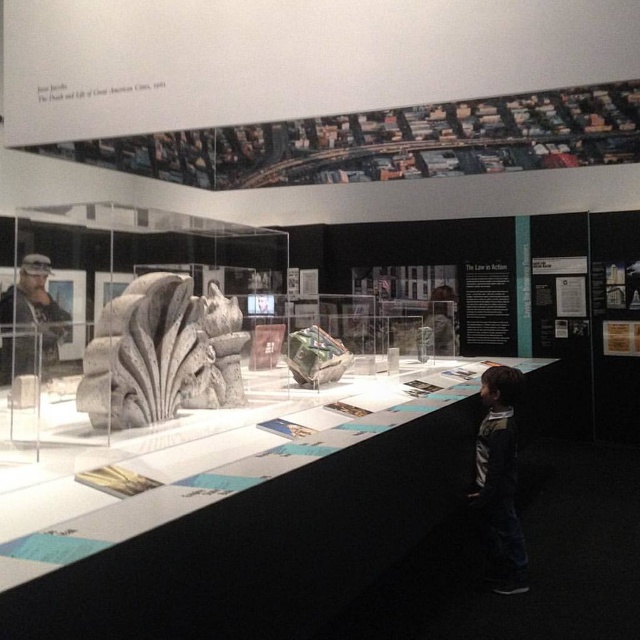
You are a security guard in the museum and need to check both the dark blue jeans at lower right and the camouflage fabric uniform at left. Which object should you inspect first if you want to start with the one closer to the floor?

The dark blue jeans at lower right should be inspected first because it is located below the camouflage fabric uniform at left, meaning it is closer to the floor.

You are standing in the museum exhibit space and want to take a photo of both the display table and the sculpture. To ensure both are in the frame, should you position yourself closer to point (1, 378) or point (492, 436)?

You should position yourself closer to point (1, 378) because point (492, 436) is behind it, so standing closer to the front point will allow both objects to be in the frame.

You are standing in the museum exhibit space and want to reach the point at coordinates (120,372). If you can walk 10 feet in a straight line, will you be able to reach that point?

The distance between you and the point at coordinates (120,372) is 7.71 feet, so yes, you can reach it since you can walk 10 feet in a straight line.